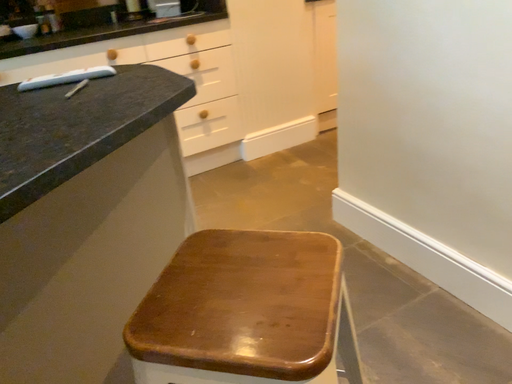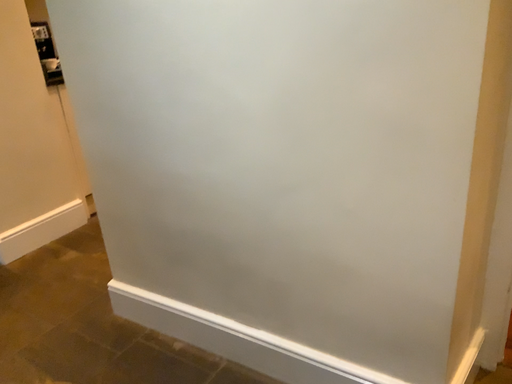
Question: Which way did the camera rotate in the video?

Choices:
 (A) rotated downward
 (B) rotated upward

Answer: (B)